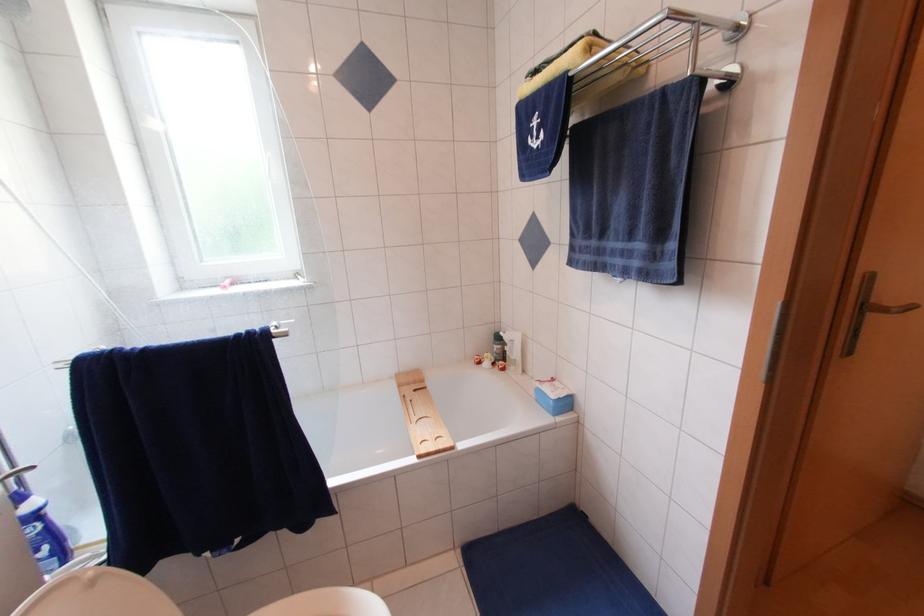
The height and width of the screenshot is (616, 924). I want to click on white window handle, so click(271, 163).